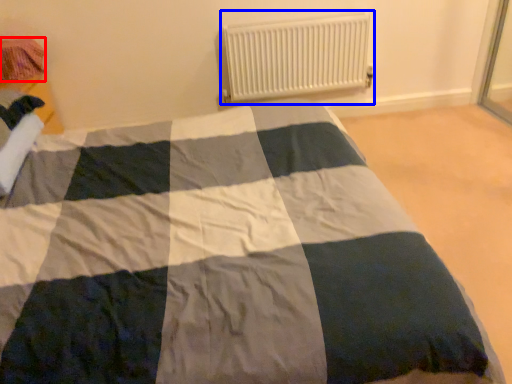
Question: Which object is closer to the camera taking this photo, material (highlighted by a red box) or radiator (highlighted by a blue box)?

Choices:
 (A) material
 (B) radiator

Answer: (A)